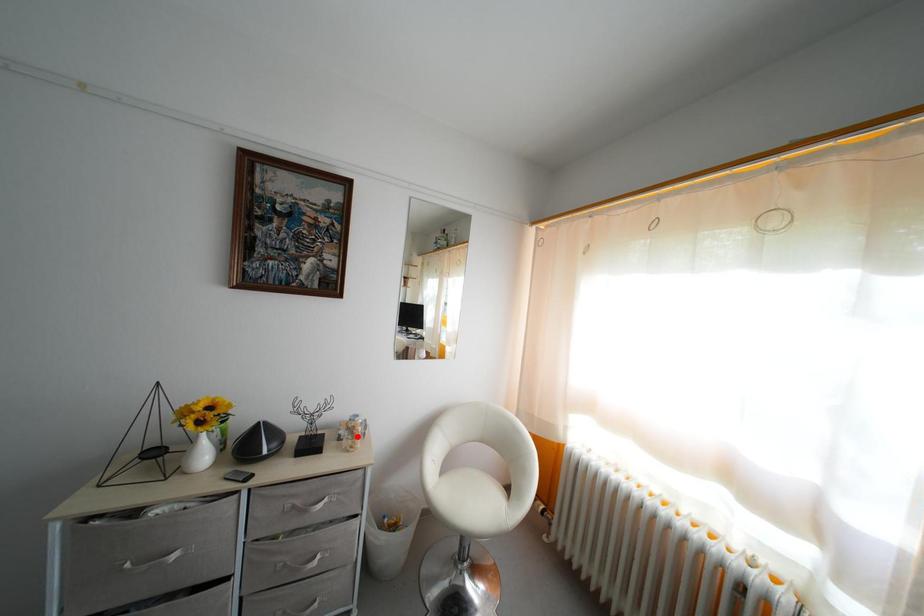
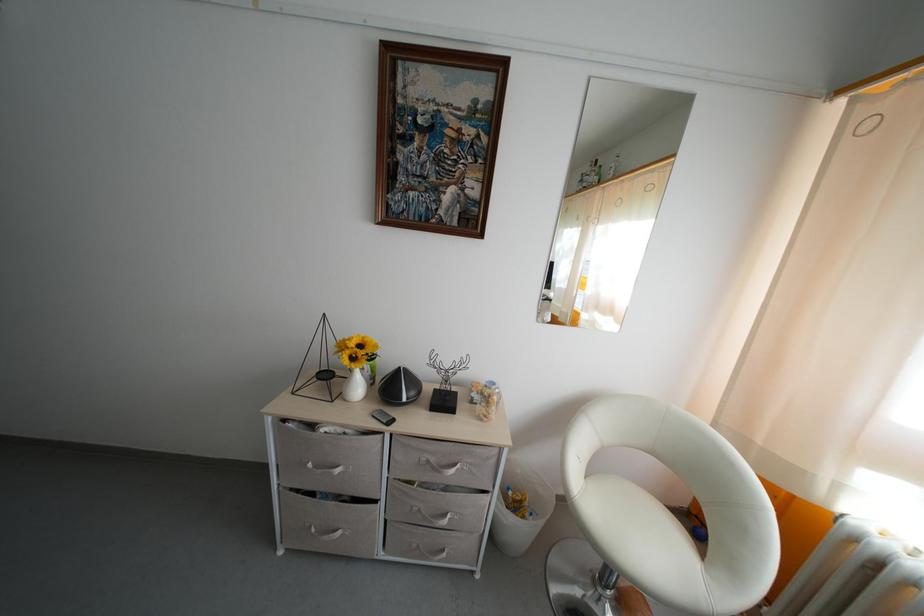
Where in the second image is the point corresponding to the highlighted location from the first image?

(493, 406)